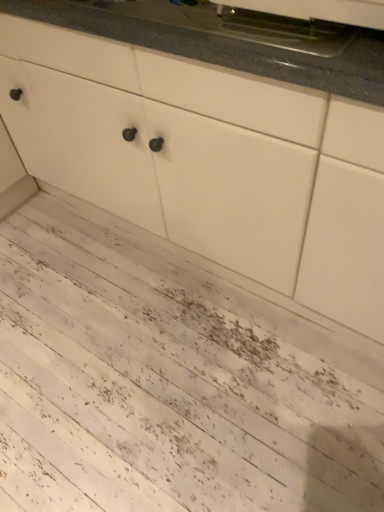
Question: Is white matte cabinet at center to the left or to the right of metallic stainless steel oven at upper center in the image?

Choices:
 (A) right
 (B) left

Answer: (B)

Question: Is white matte cabinet at center in front of or behind metallic stainless steel oven at upper center in the image?

Choices:
 (A) behind
 (B) front

Answer: (B)

Question: Estimate the real-world distances between objects in this image. Which object is farther from the metallic stainless steel oven at upper center?

Choices:
 (A) white textured wood at lower left
 (B) white matte cabinet at center
 (C) granite gray countertop at upper center

Answer: (A)

Question: Which object is the closest to the metallic stainless steel oven at upper center?

Choices:
 (A) granite gray countertop at upper center
 (B) white matte cabinet at center
 (C) white textured wood at lower left

Answer: (A)